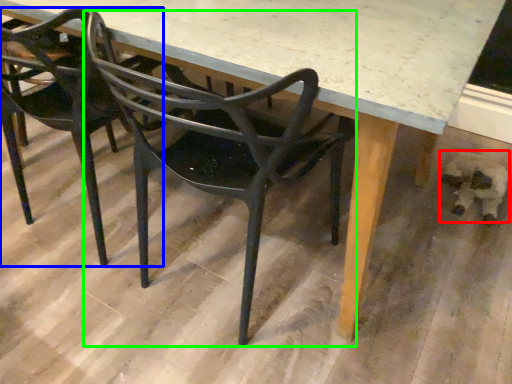
Question: Which is nearer to the animal (highlighted by a red box)? chair (highlighted by a blue box) or chair (highlighted by a green box).

Choices:
 (A) chair
 (B) chair

Answer: (B)